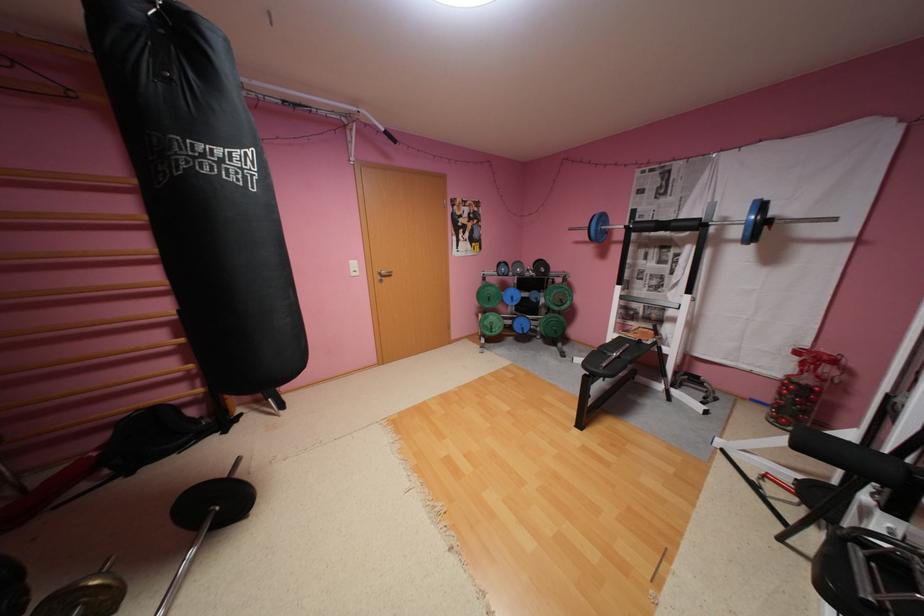
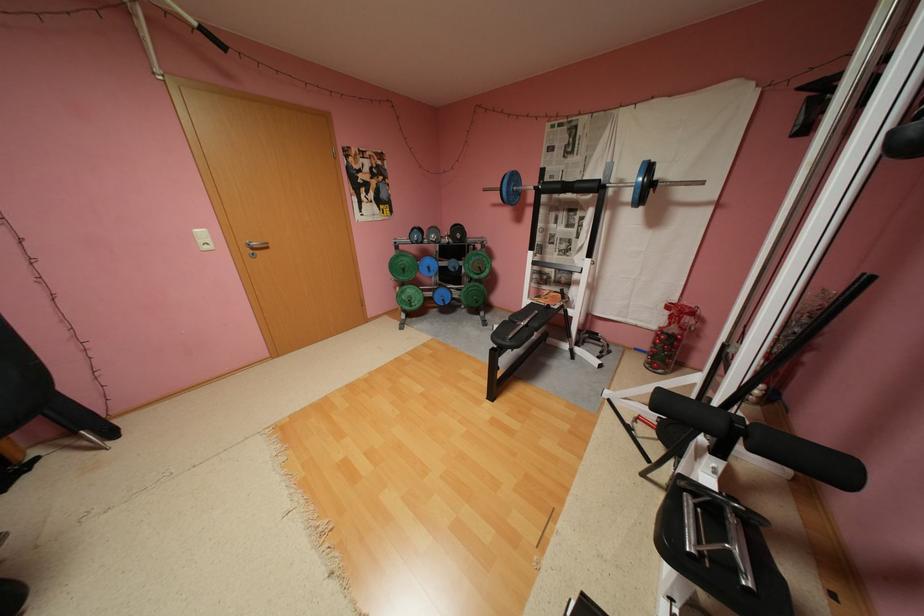
In the second image, find the point that corresponds to pixel 497 299 in the first image.

(412, 270)